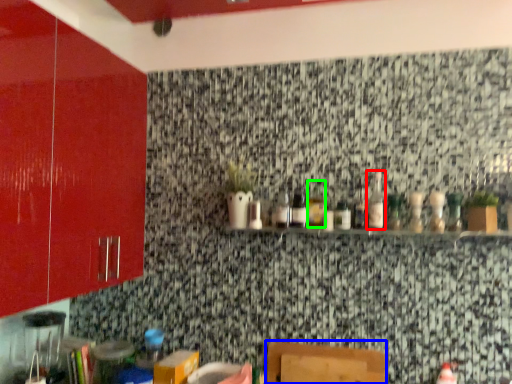
Question: Based on their relative distances, which object is farther from bottle (highlighted by a red box)? Choose from furniture (highlighted by a blue box) and bottle (highlighted by a green box).

Choices:
 (A) furniture
 (B) bottle

Answer: (A)